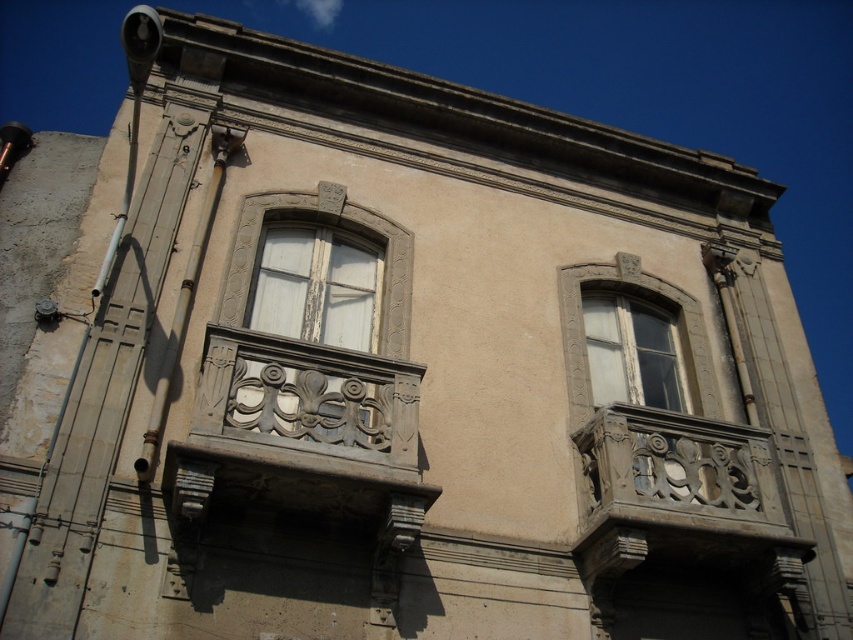
Question: Is carved stone balcony at center above white wooden window at upper right?

Choices:
 (A) no
 (B) yes

Answer: (A)

Question: Is carved stone balcony at center wider than white wood window at center?

Choices:
 (A) yes
 (B) no

Answer: (A)

Question: Estimate the real-world distances between objects in this image. Which object is farther from the carved stone balcony at center?

Choices:
 (A) white wooden window at upper right
 (B) white wood window at center

Answer: (A)

Question: Considering the real-world distances, which object is farthest from the carved stone balcony at center?

Choices:
 (A) white wooden window at upper right
 (B) white wood window at center

Answer: (A)

Question: Which point is closer to the camera?

Choices:
 (A) white wood window at center
 (B) white wooden window at upper right

Answer: (A)

Question: Can you confirm if carved stone balcony at center is positioned below white wooden window at upper right?

Choices:
 (A) yes
 (B) no

Answer: (A)